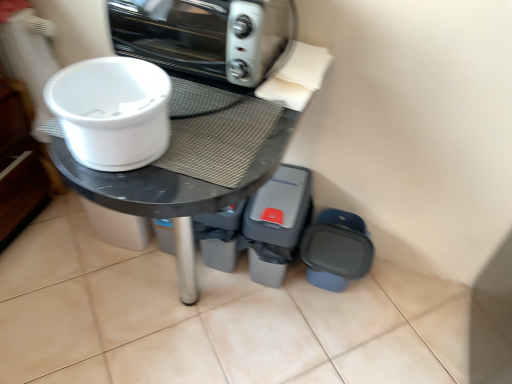
The image size is (512, 384). I want to click on vacant area located to the right-hand side of matte black table at center, so click(x=342, y=331).